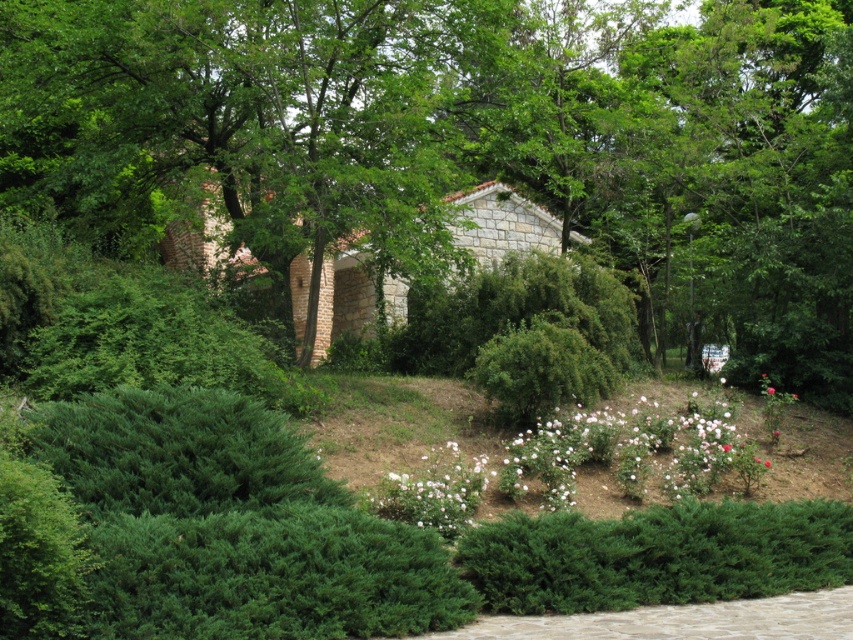
You are standing in the garden and want to walk from the green textured hedge at lower left to the green textured hedge at lower center. Which direction should you move to reach the second hedge?

You should move downward because the green textured hedge at lower left is above the green textured hedge at lower center, so moving downward will take you towards it.

You are a gardener planning to install a new sprinkler system. You need to place a sprinkler between the green textured hedge at lower left and the green textured hedge at lower center. The sprinkler requires a minimum of 5 feet of space between the hedges to function properly. Based on the garden layout, will the sprinkler fit in this location?

The green textured hedge at lower left is 6.31 feet from the green textured hedge at lower center. Since the required minimum space is 5 feet, the sprinkler will fit between them as there is sufficient space.